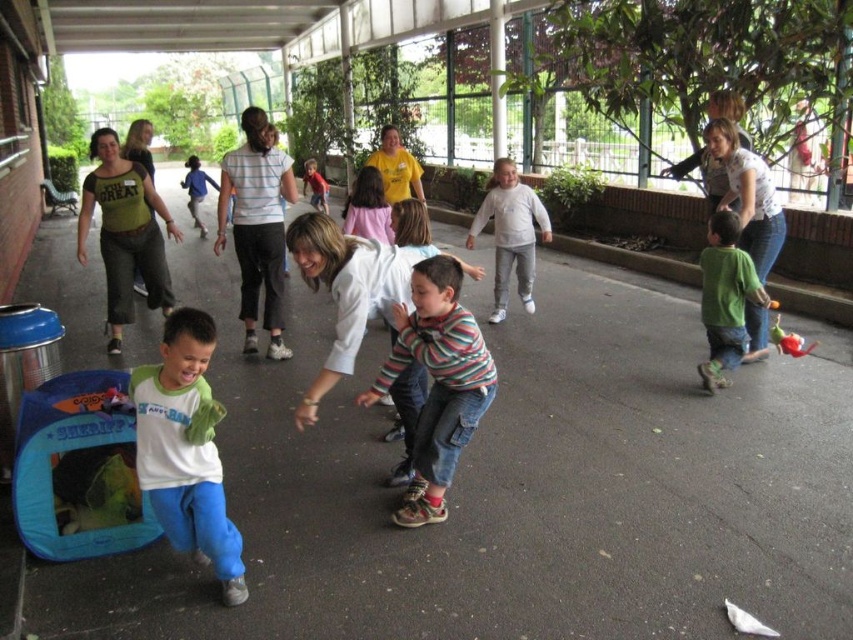
Does white matte shirt at center appear on the left side of green matte shirt at right?

Yes, white matte shirt at center is to the left of green matte shirt at right.

Is white matte shirt at center to the right of green matte shirt at right from the viewer's perspective?

In fact, white matte shirt at center is to the left of green matte shirt at right.

Between point (189, 477) and point (708, 257), which one is positioned in front?

Positioned in front is point (189, 477).

Where is `white matte shirt at center`? The width and height of the screenshot is (853, 640). white matte shirt at center is located at coordinates (186, 449).

Which is behind, point (456, 326) or point (720, 228)?

The point (720, 228) is more distant.

Is striped cotton shirt at center smaller than green matte shirt at right?

No, striped cotton shirt at center is not smaller than green matte shirt at right.

You are a GUI agent. You are given a task and a screenshot of the screen. Output one action in this format:
    pyautogui.click(x=<x>, y=<y>)
    Task: Click on the striped cotton shirt at center
    
    Given the screenshot: What is the action you would take?
    pyautogui.click(x=438, y=384)

Can you confirm if white matte shirt at center is positioned above striped cotton shirt at center?

No.

Describe the element at coordinates (186, 449) in the screenshot. This screenshot has height=640, width=853. I see `white matte shirt at center` at that location.

Find the location of `white matte shirt at center`. white matte shirt at center is located at coordinates (186, 449).